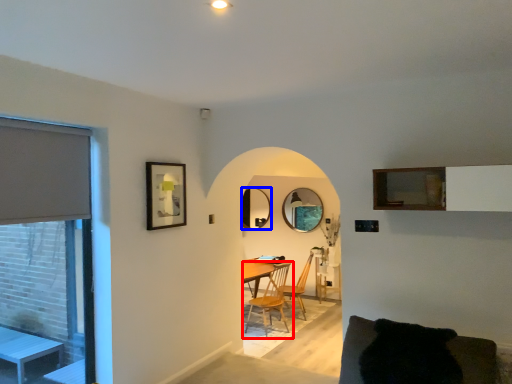
Question: Among these objects, which one is nearest to the camera, chair (highlighted by a red box) or mirror (highlighted by a blue box)?

Choices:
 (A) chair
 (B) mirror

Answer: (A)